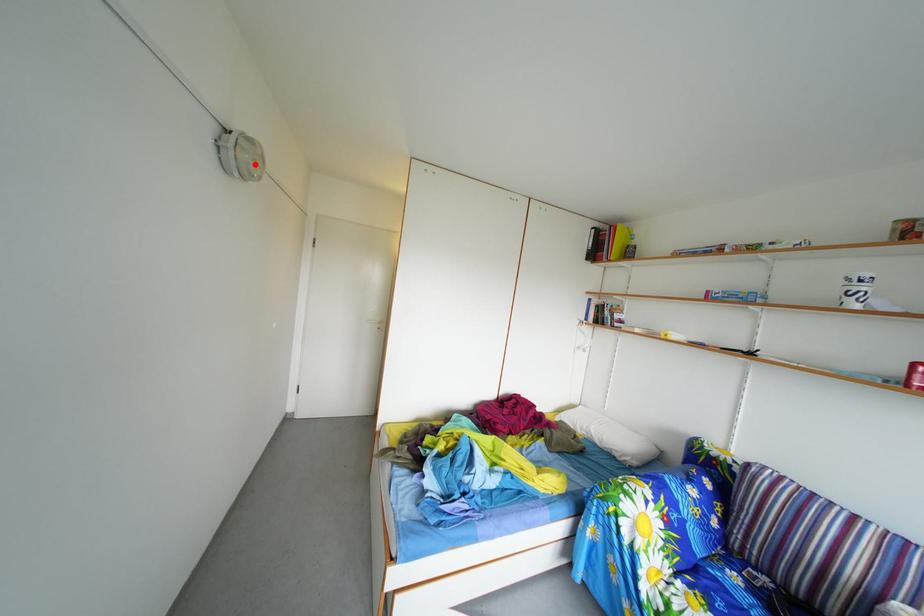
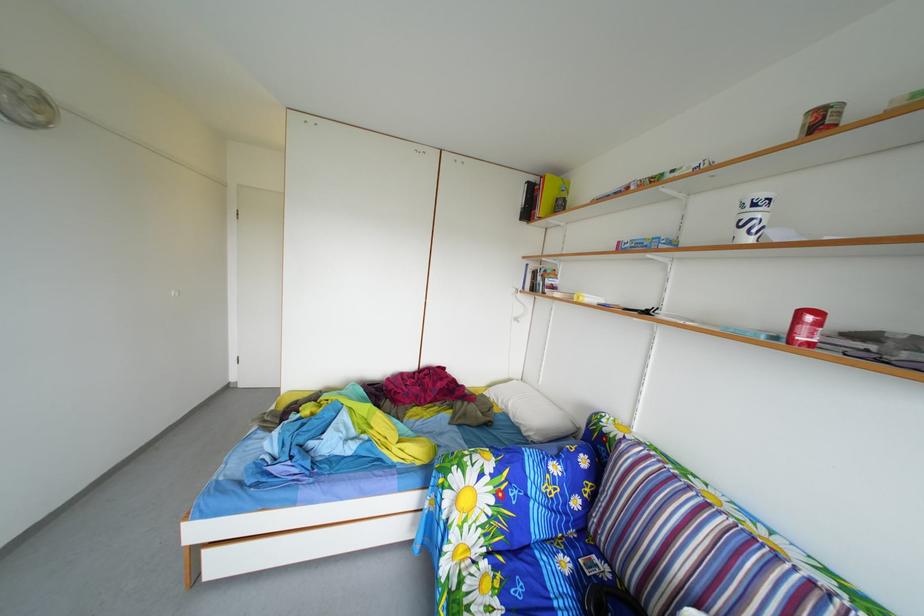
Where in the second image is the point corresponding to the highlighted location from the first image?

(14, 105)